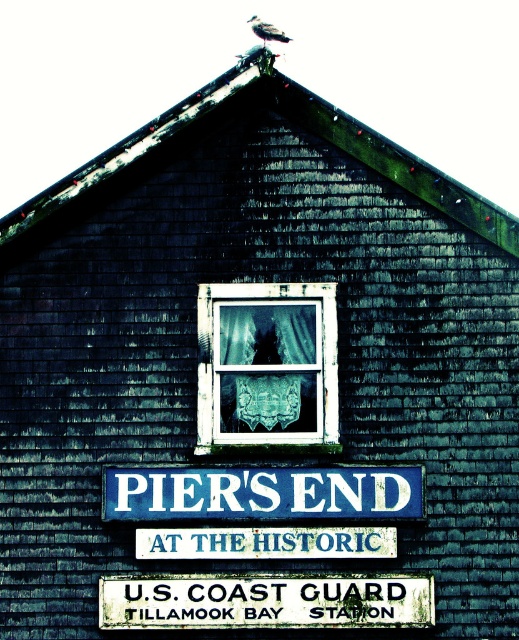
Image resolution: width=519 pixels, height=640 pixels. Describe the element at coordinates (265, 602) in the screenshot. I see `white painted wood at bottom` at that location.

Is point (296, 627) positioned before point (157, 547)?

That is True.

Does point (110, 579) lie behind point (283, 534)?

Yes, point (110, 579) is farther from viewer.

Locate an element on the screen. The width and height of the screenshot is (519, 640). white painted wood at bottom is located at coordinates (265, 602).

Does white lace curtain at center have a smaller size compared to blue painted wood sign at center?

No, white lace curtain at center is not smaller than blue painted wood sign at center.

Between white lace curtain at center and blue painted wood sign at center, which one is positioned higher?

Positioned higher is white lace curtain at center.

Locate an element on the screen. The image size is (519, 640). white lace curtain at center is located at coordinates (266, 364).

The width and height of the screenshot is (519, 640). Identify the location of white lace curtain at center. (266, 364).

From the picture: Does white painted wood at bottom have a greater height compared to blue painted wood at center?

Yes, white painted wood at bottom is taller than blue painted wood at center.

Is point (332, 627) positioned after point (375, 502)?

No, it is not.

You are a GUI agent. You are given a task and a screenshot of the screen. Output one action in this format:
    pyautogui.click(x=<x>, y=<y>)
    Task: Click on the white painted wood at bottom
    The height and width of the screenshot is (640, 519).
    Given the screenshot: What is the action you would take?
    pyautogui.click(x=265, y=602)